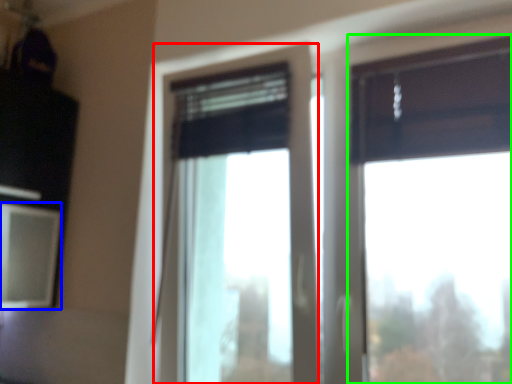
Question: Which is farther away from window (highlighted by a red box)? window screen (highlighted by a blue box) or window (highlighted by a green box)?

Choices:
 (A) window screen
 (B) window

Answer: (B)